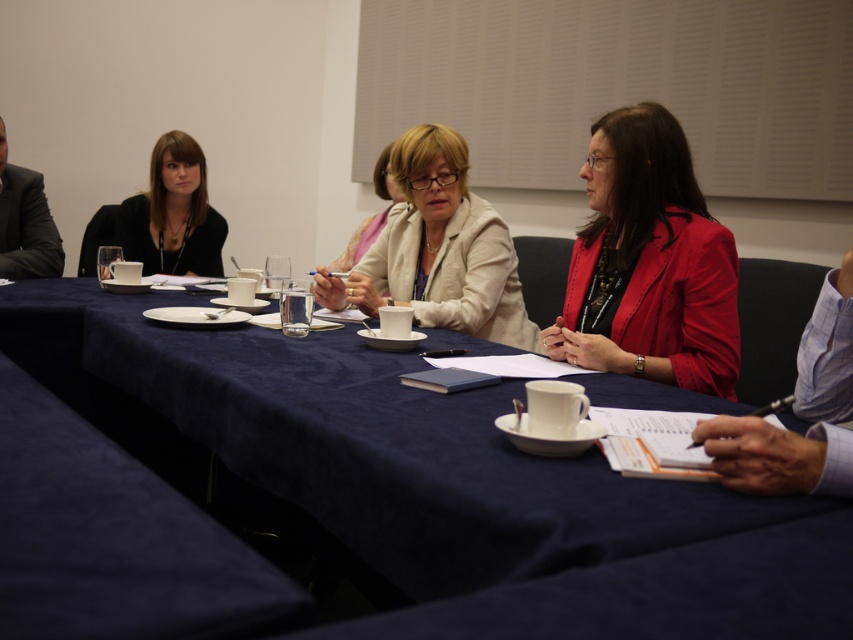
Question: Estimate the real-world distances between objects in this image. Which object is closer to the blue fabric table at center?

Choices:
 (A) matte beige blazer at center
 (B) matte black jacket at upper left
 (C) matte red blazer at center
 (D) matte beige jacket at center

Answer: (C)

Question: Does matte black jacket at upper left appear over matte beige jacket at center?

Choices:
 (A) no
 (B) yes

Answer: (A)

Question: Which of the following is the closest to the observer?

Choices:
 (A) (521, 310)
 (B) (437, 448)
 (C) (363, 250)

Answer: (B)

Question: Which point is farther from the camera taking this photo?

Choices:
 (A) (733, 600)
 (B) (416, 202)
 (C) (335, 264)

Answer: (C)

Question: Can you confirm if matte red blazer at center is positioned above matte beige blazer at center?

Choices:
 (A) yes
 (B) no

Answer: (B)

Question: Is matte black jacket at upper left wider than matte beige jacket at center?

Choices:
 (A) yes
 (B) no

Answer: (A)